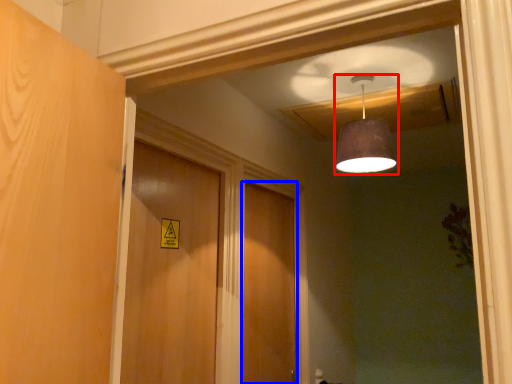
Question: Among these objects, which one is farthest to the camera, lamp (highlighted by a red box) or door (highlighted by a blue box)?

Choices:
 (A) lamp
 (B) door

Answer: (B)